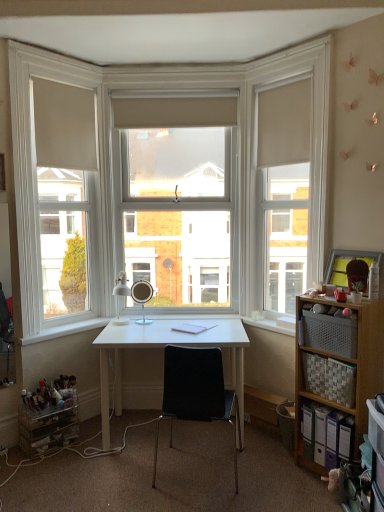
Where is `vacant area in front of white glossy desk at center`? vacant area in front of white glossy desk at center is located at coordinates (152, 485).